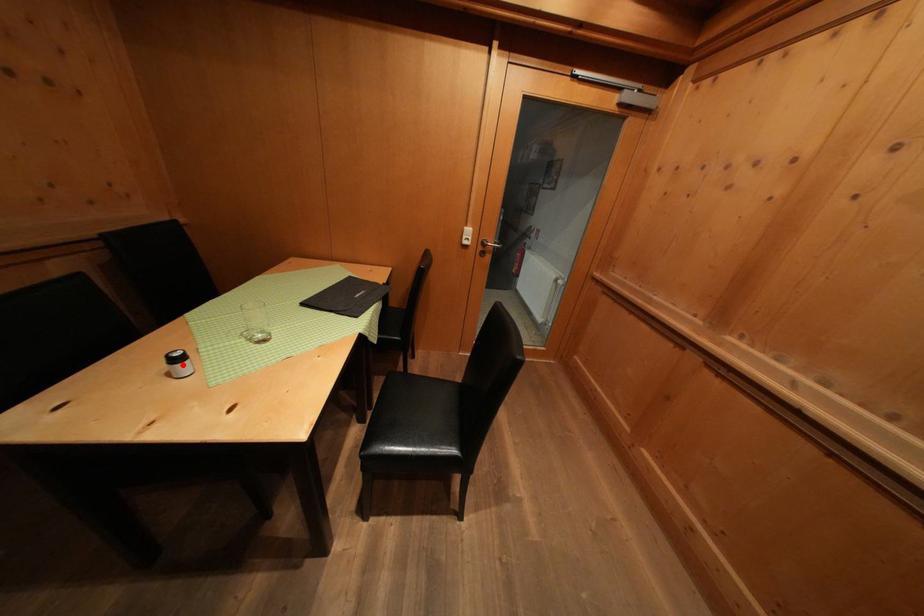
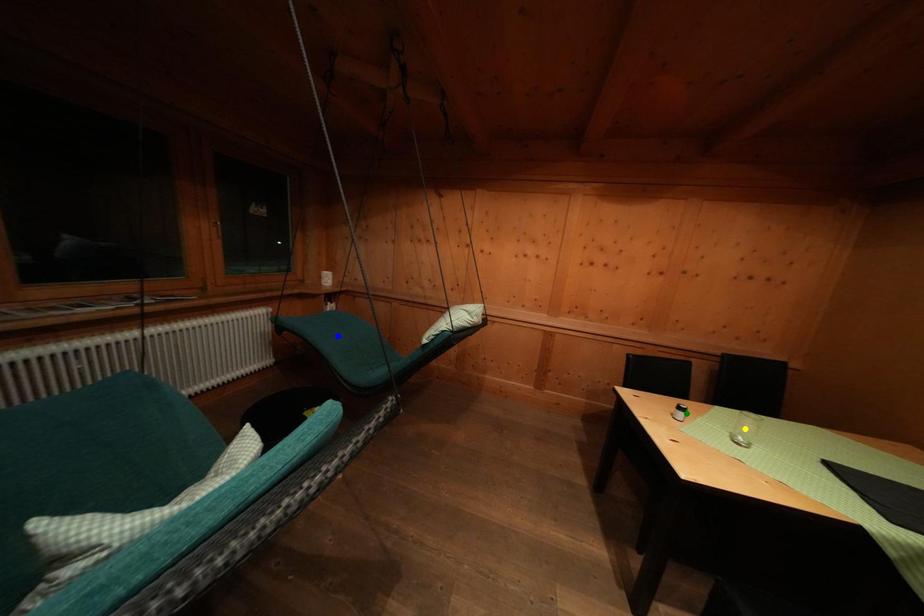
Question: I am providing you with two images of the same scene from different viewpoints. A red point is marked on the first image. You are given multiple points on the second image. Which point in image 2 represents the same 3d spot as the red point in image 1?

Choices:
 (A) yellow point
 (B) blue point
 (C) green point

Answer: (C)